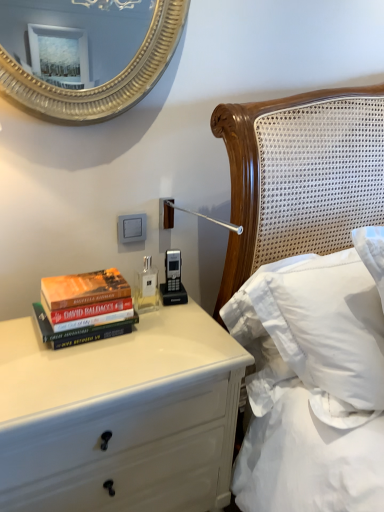
Question: Is hardcover books at left to the right of clear glass bottle at center from the viewer's perspective?

Choices:
 (A) yes
 (B) no

Answer: (B)

Question: From the image's perspective, is hardcover books at left located above clear glass bottle at center?

Choices:
 (A) yes
 (B) no

Answer: (B)

Question: Is hardcover books at left positioned before clear glass bottle at center?

Choices:
 (A) yes
 (B) no

Answer: (A)

Question: From a real-world perspective, does hardcover books at left stand above clear glass bottle at center?

Choices:
 (A) yes
 (B) no

Answer: (A)

Question: Considering the relative sizes of hardcover books at left and clear glass bottle at center in the image provided, is hardcover books at left bigger than clear glass bottle at center?

Choices:
 (A) yes
 (B) no

Answer: (A)

Question: Based on their sizes in the image, would you say white soft pillow at upper right is bigger or smaller than hardcover books at left?

Choices:
 (A) big
 (B) small

Answer: (A)

Question: Is white soft pillow at upper right inside the boundaries of hardcover books at left, or outside?

Choices:
 (A) inside
 (B) outside

Answer: (B)

Question: In the image, is white soft pillow at upper right positioned in front of or behind hardcover books at left?

Choices:
 (A) front
 (B) behind

Answer: (A)

Question: Is white soft pillow at upper right wider or thinner than hardcover books at left?

Choices:
 (A) wide
 (B) thin

Answer: (A)

Question: Is clear glass bottle at center taller or shorter than white glossy chest of drawers at lower left?

Choices:
 (A) tall
 (B) short

Answer: (B)

Question: From the image's perspective, is clear glass bottle at center positioned above or below white glossy chest of drawers at lower left?

Choices:
 (A) above
 (B) below

Answer: (A)

Question: Looking at the image, does clear glass bottle at center seem bigger or smaller compared to white glossy chest of drawers at lower left?

Choices:
 (A) small
 (B) big

Answer: (A)

Question: Is clear glass bottle at center in front of or behind white glossy chest of drawers at lower left in the image?

Choices:
 (A) behind
 (B) front

Answer: (A)

Question: From their relative heights in the image, would you say clear glass bottle at center is taller or shorter than white soft pillow at upper right?

Choices:
 (A) tall
 (B) short

Answer: (B)

Question: Considering the relative positions of clear glass bottle at center and white soft pillow at upper right in the image provided, is clear glass bottle at center to the left or to the right of white soft pillow at upper right?

Choices:
 (A) right
 (B) left

Answer: (B)